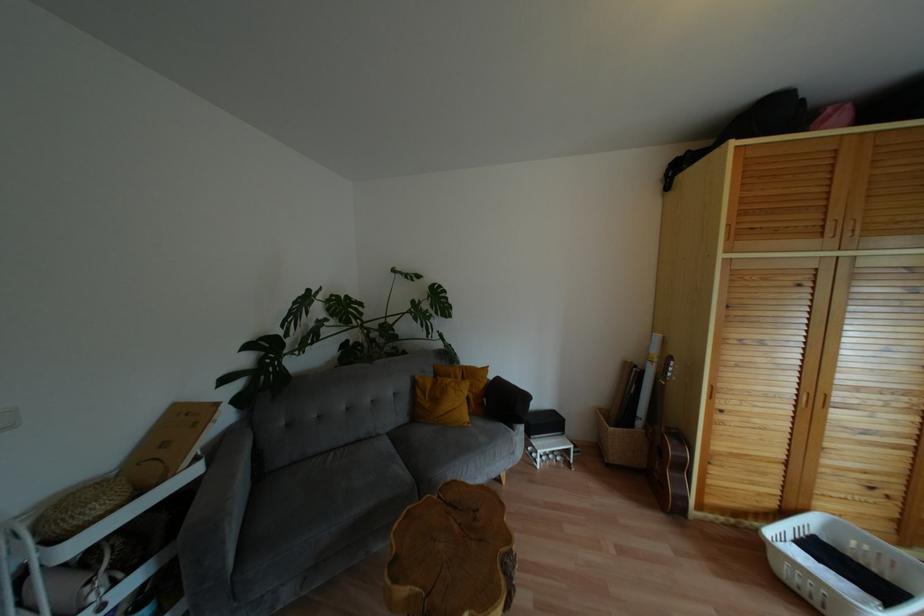
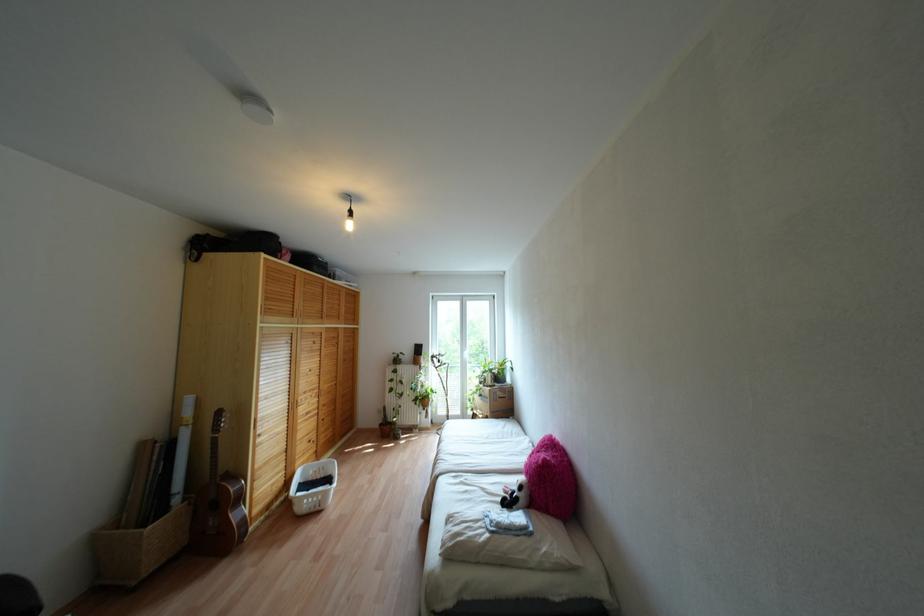
In the second image, find the point that corresponds to (x=682, y=467) in the first image.

(238, 498)